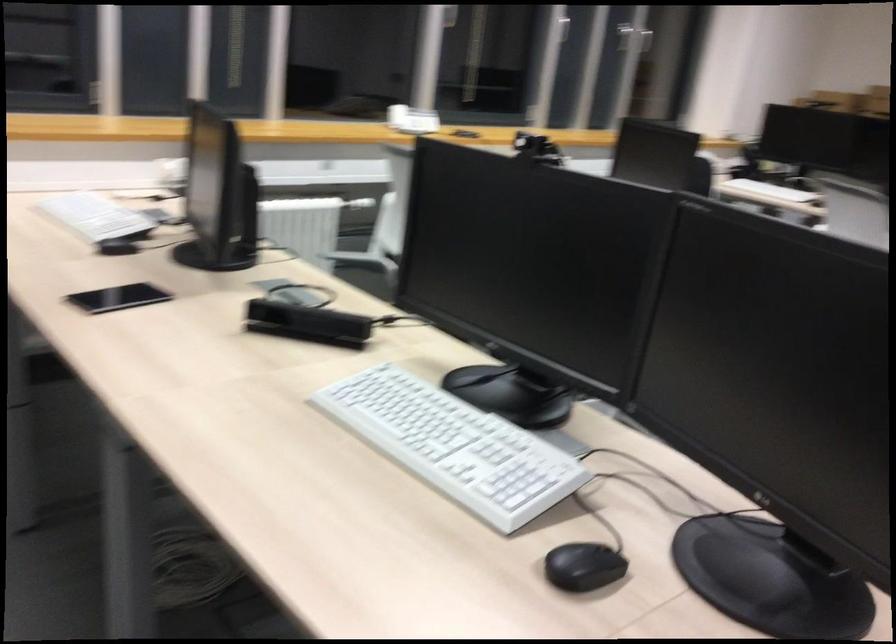
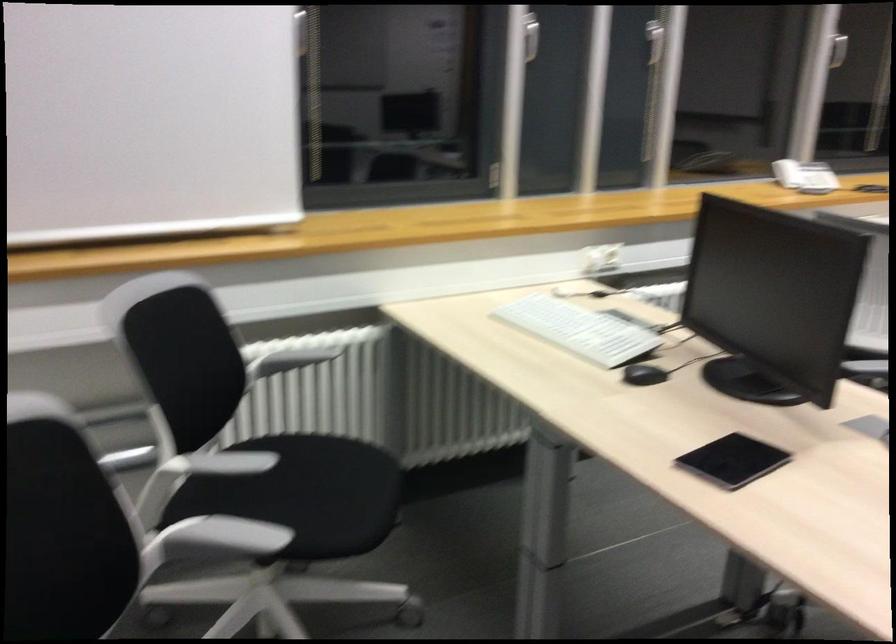
Question: How did the camera likely rotate?

Choices:
 (A) Left
 (B) Right
 (C) Up
 (D) Down

Answer: (A)